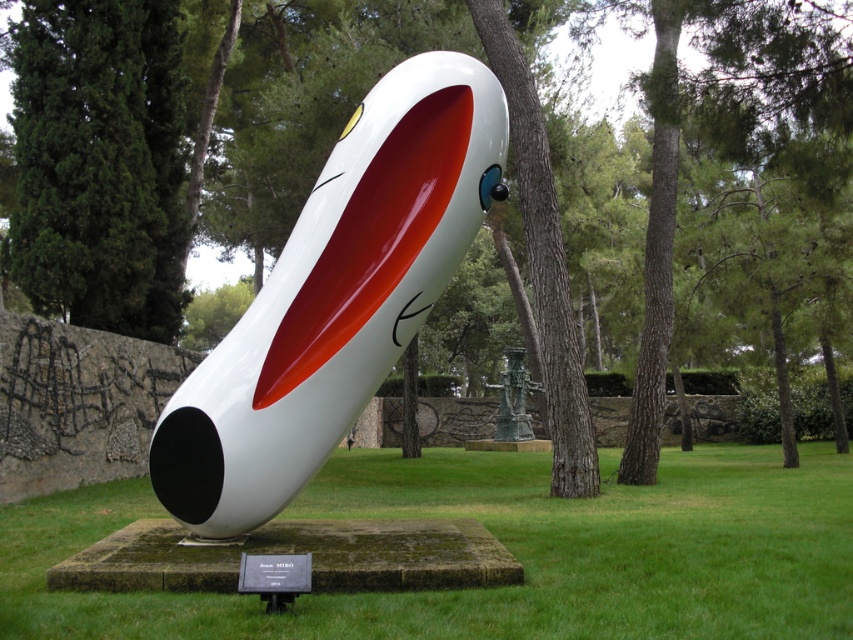
Can you confirm if green grass at center is positioned above green patinated metal statue at center?

Incorrect, green grass at center is not positioned above green patinated metal statue at center.

Which is in front, point (498, 616) or point (520, 390)?

Positioned in front is point (498, 616).

Between point (573, 576) and point (512, 426), which one is positioned in front?

Point (573, 576) is more forward.

What are the coordinates of `green grass at center` in the screenshot? It's located at (506, 547).

Is point (515, 520) positioned after point (280, 301)?

Yes, it is.

Does green grass at center have a lesser width compared to white glossy rocket at center?

No, green grass at center is not thinner than white glossy rocket at center.

Locate an element on the screen. This screenshot has height=640, width=853. green grass at center is located at coordinates (506, 547).

Find the location of a particular element. The image size is (853, 640). green grass at center is located at coordinates (506, 547).

From the picture: Does white glossy rocket at center have a lesser width compared to green patinated metal statue at center?

In fact, white glossy rocket at center might be wider than green patinated metal statue at center.

Between white glossy rocket at center and green patinated metal statue at center, which one is positioned lower?

green patinated metal statue at center is below.

Is point (379, 125) positioned behind point (512, 348)?

No, it is not.

The height and width of the screenshot is (640, 853). I want to click on white glossy rocket at center, so click(335, 296).